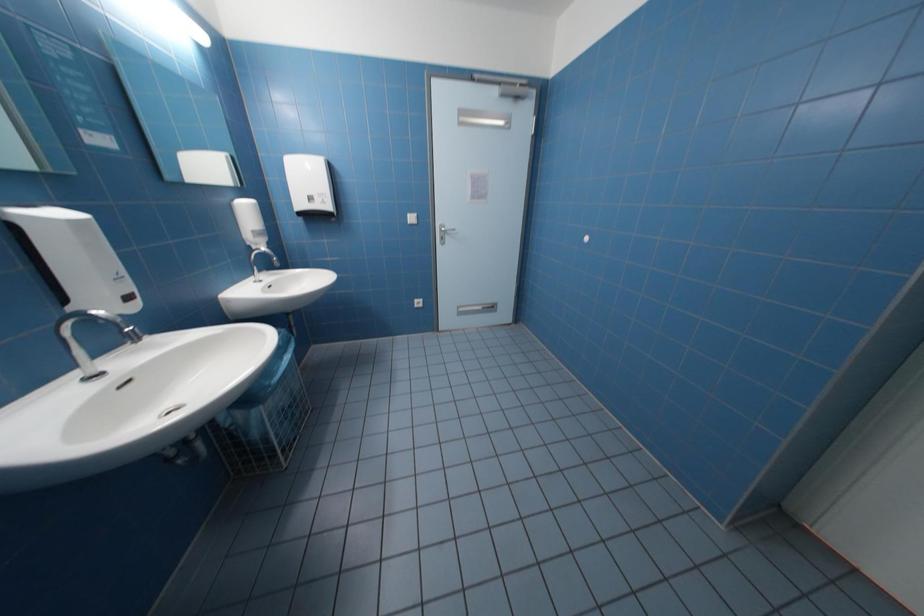
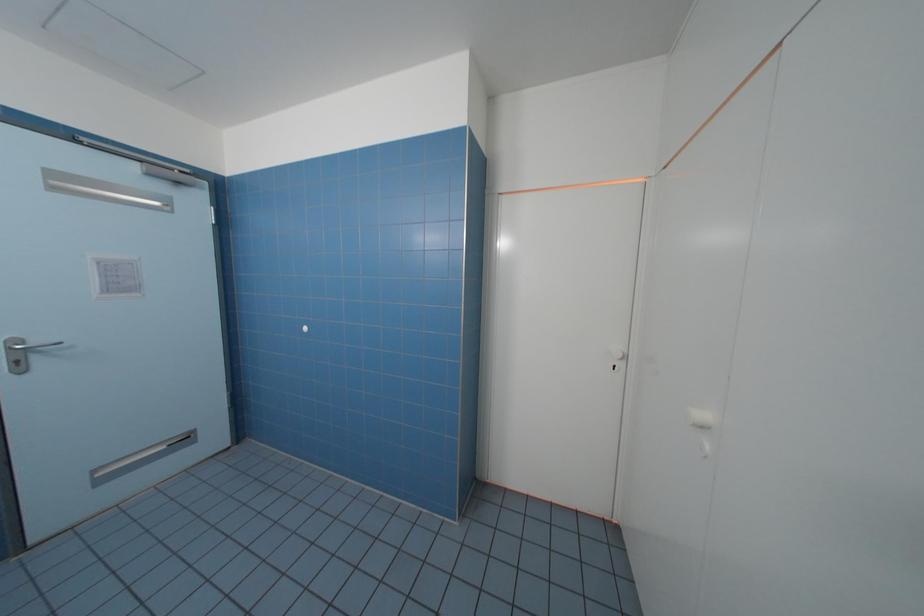
Question: The first image is from the beginning of the video and the second image is from the end. How did the camera likely rotate when shooting the video?

Choices:
 (A) Left
 (B) Right
 (C) Up
 (D) Down

Answer: (B)